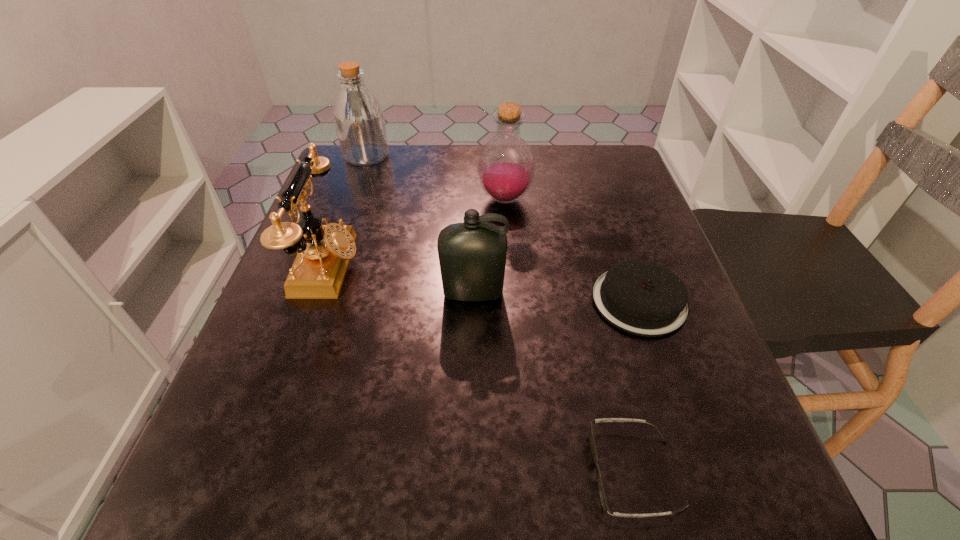
Choose which object is the fourth nearest neighbor to the nearest bottle. Please provide its 2D coordinates. Your answer should be formatted as a tuple, i.e. [(x, y)], where the tuple contains the x and y coordinates of a point satisfying the conditions above.

[(604, 504)]

I want to click on bottle that stands as the second closest to the nearest bottle, so click(x=358, y=116).

The height and width of the screenshot is (540, 960). I want to click on bottle that can be found as the second closest to the sunglasses, so click(x=506, y=168).

At what (x,y) coordinates should I click in order to perform the action: click on vacant space that satisfies the following two spatial constraints: 1. on the dial of the telephone; 2. on the left side of the pancake. Please return your answer as a coordinate pair (x, y). Looking at the image, I should click on (317, 301).

Locate an element on the screen. The width and height of the screenshot is (960, 540). vacant space that satisfies the following two spatial constraints: 1. on the dial of the shortest bottle; 2. on the left side of the telephone is located at coordinates (319, 293).